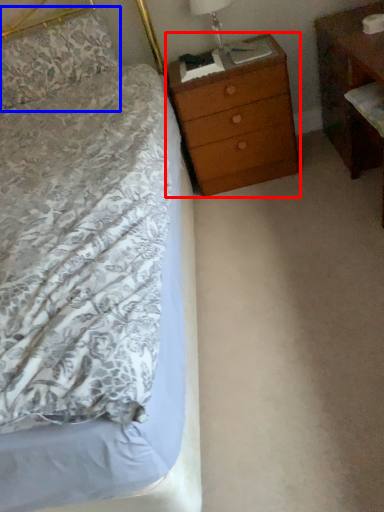
Question: Which object appears closest to the camera in this image, chest of drawers (highlighted by a red box) or pillow (highlighted by a blue box)?

Choices:
 (A) chest of drawers
 (B) pillow

Answer: (A)